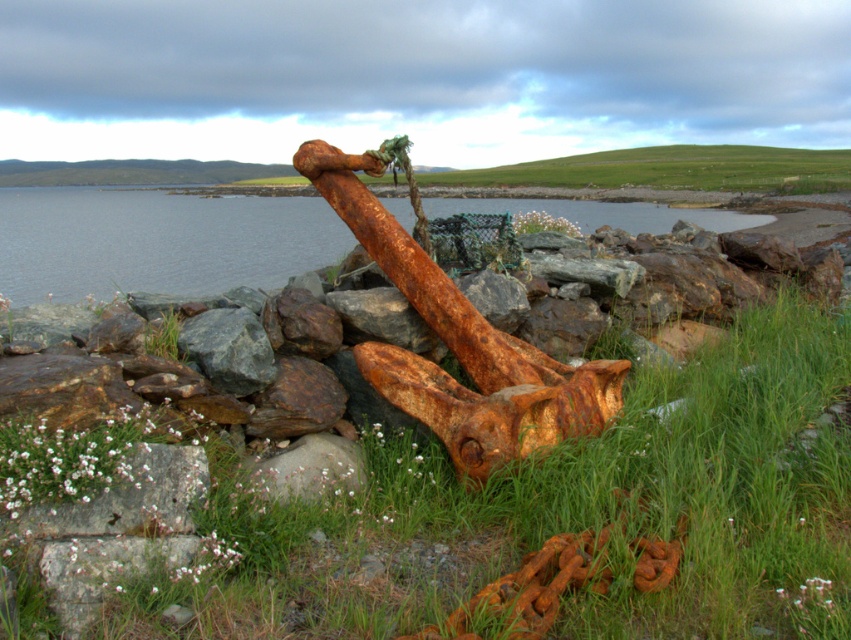
You are a gardener trying to maintain the green grass at center and the rusty metallic water at center. Which one is taller?

The rusty metallic water at center is taller than the green grass at center.

You are a landscape architect designing a garden. You observe the image and notice the green grass at center and the rusty metallic water at center. Which of these two elements covers a smaller area in the scene?

The green grass at center occupies less space than the rusty metallic water at center, so the green grass at center covers a smaller area in the scene.

You are a person standing on the beach looking at the anchor. You see the green grass at center and the rusty metallic water at center. Which one is closer to you?

The green grass at center is closer to you because it is in front of the rusty metallic water at center.